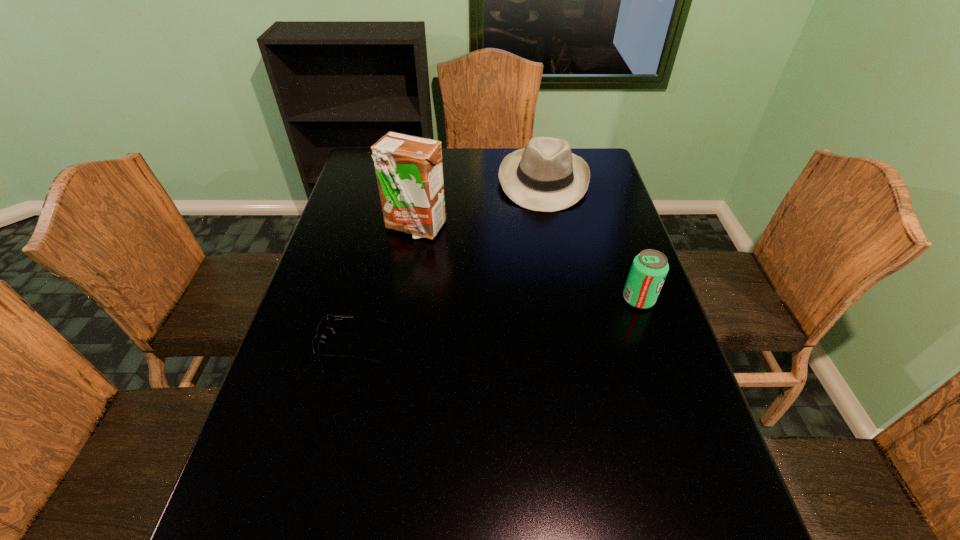
In order to click on free space on the desktop that is between the sunglasses and the pop soda and is positioned on the straw side of the carton in this screenshot , I will do `click(459, 327)`.

What are the coordinates of `free space on the desktop that is between the sunglasses and the pop soda and is positioned on the front-facing side of the fedora` in the screenshot? It's located at (543, 314).